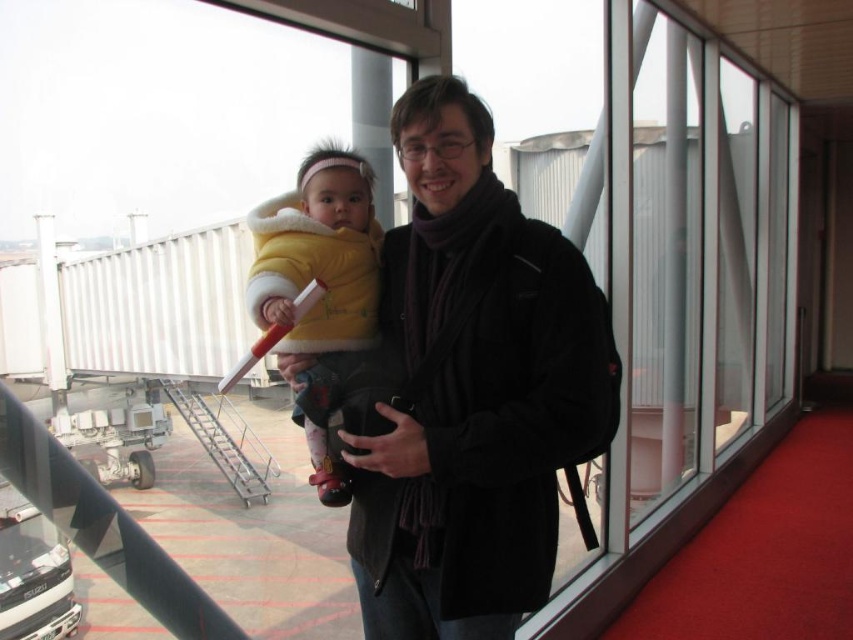
In the scene shown: You are a fashion designer who wants to create a new collection based on the jackets seen in the image. Which jacket, the matte black jacket at center or the yellow fleece jacket at center, would you choose as the base for a larger, more voluminous design?

The matte black jacket at center is larger in size compared to the yellow fleece jacket at center, so it would be a better base for a larger, more voluminous design.

In the scene shown: You are a security guard at the airport and need to check the jackets of the man and the baby. The man is wearing a matte black jacket at center and the baby is wearing a yellow fleece jacket at center. Which jacket is positioned to the right of the other?

The matte black jacket at center is to the right of yellow fleece jacket at center.